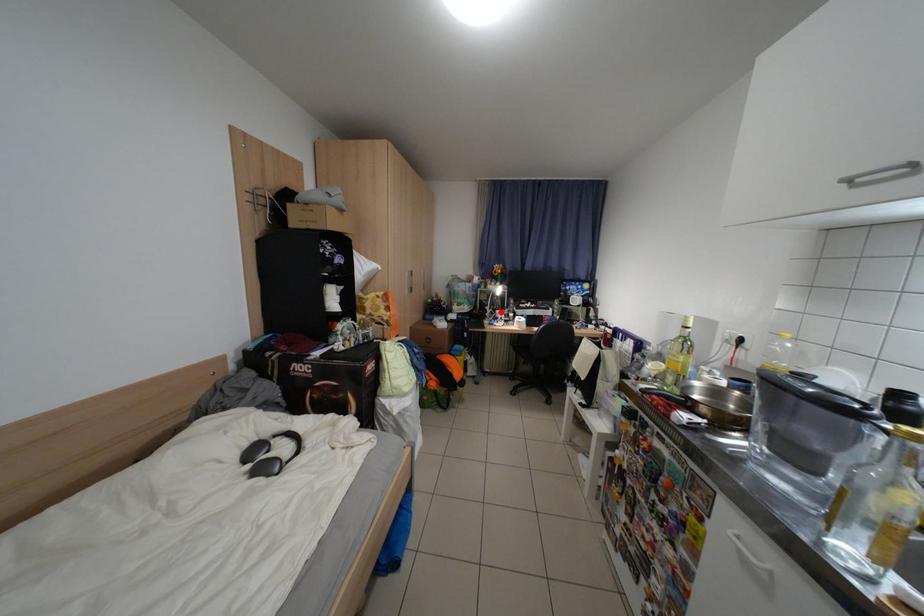
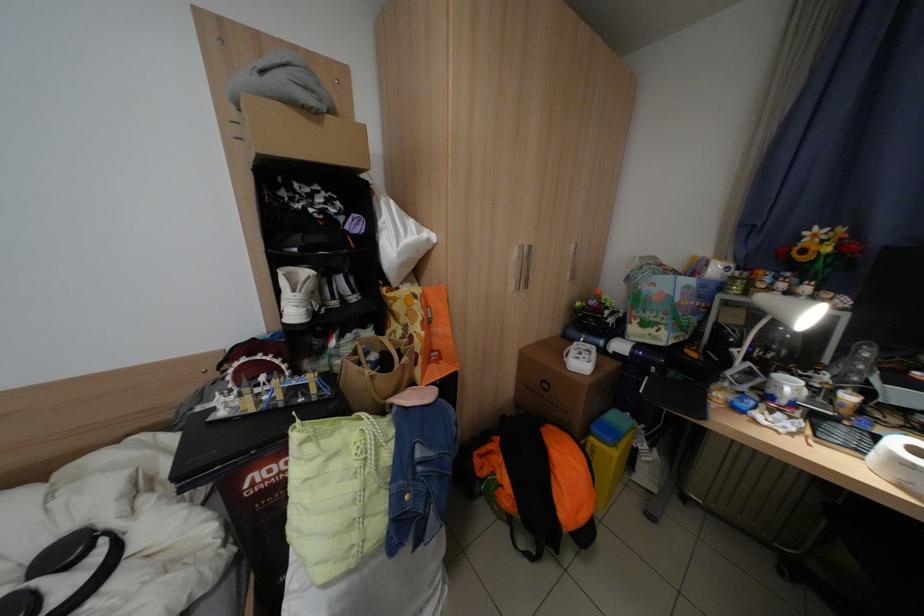
The point at the highlighted location is marked in the first image. Where is the corresponding point in the second image?

(752, 366)